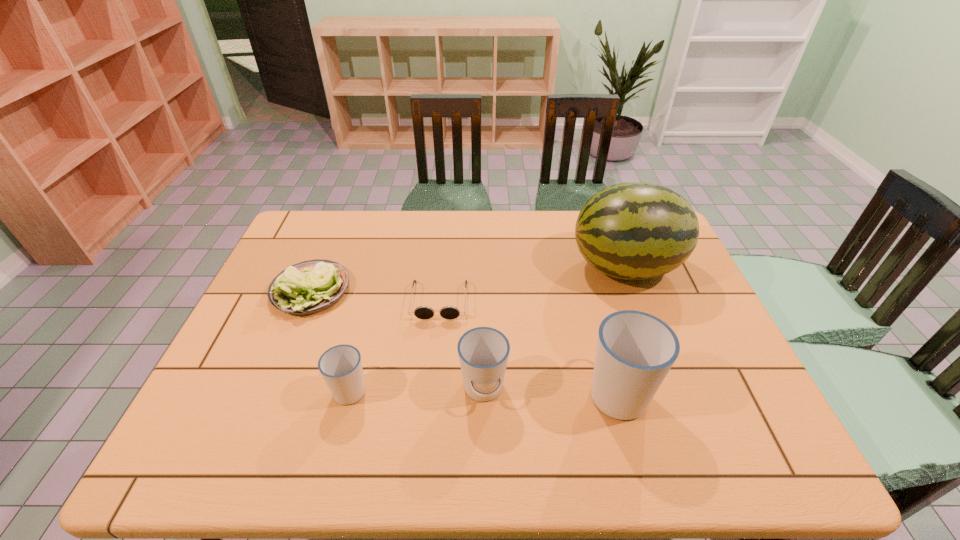
Where is `vacant place for an extra cup on the right`? This screenshot has width=960, height=540. vacant place for an extra cup on the right is located at coordinates (751, 392).